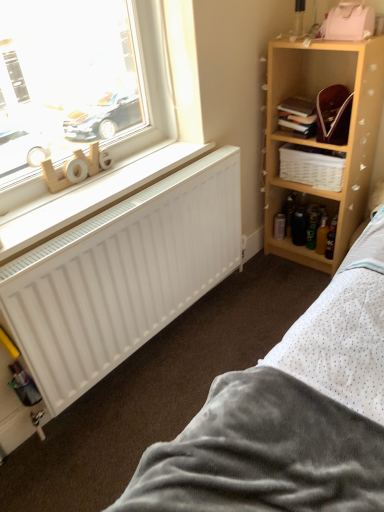
Find the location of a particular element. Image resolution: width=384 pixels, height=512 pixels. empty space that is ontop of gray soft fabric bed at lower right (from a real-world perspective) is located at coordinates (191, 369).